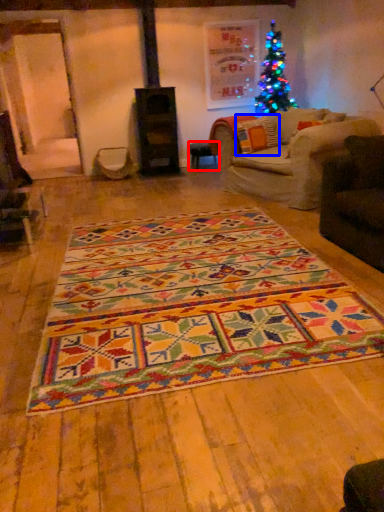
Question: Which object is further to the camera taking this photo, table (highlighted by a red box) or pillow (highlighted by a blue box)?

Choices:
 (A) table
 (B) pillow

Answer: (A)